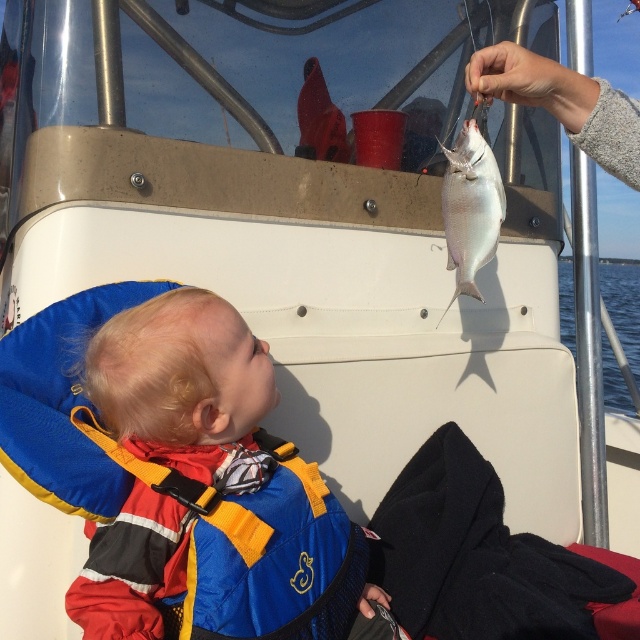
Question: Which object is the farthest from the silver metallic fish at upper center?

Choices:
 (A) smooth silver fish at upper right
 (B) blue fabric life vest at center

Answer: (B)

Question: Is smooth silver fish at upper right smaller than silver metallic fish at upper center?

Choices:
 (A) yes
 (B) no

Answer: (A)

Question: Which point is farther to the camera?

Choices:
 (A) (592, 99)
 (B) (476, 262)
 (C) (132, 321)

Answer: (B)

Question: Is blue fabric life vest at center behind smooth silver fish at upper right?

Choices:
 (A) no
 (B) yes

Answer: (A)

Question: Which point appears closest to the camera in this image?

Choices:
 (A) (637, 138)
 (B) (124, 362)

Answer: (A)

Question: Does blue fabric life vest at center have a lesser width compared to silver metallic fish at upper center?

Choices:
 (A) yes
 (B) no

Answer: (B)